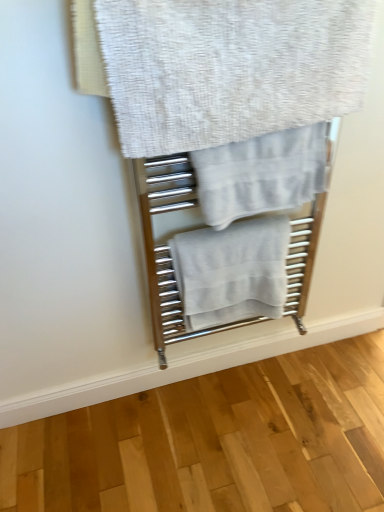
Find the location of a particular element. The height and width of the screenshot is (512, 384). free point above light gray cotton towel at center, which is the second towel from bottom to top (from a real-world perspective) is located at coordinates (266, 122).